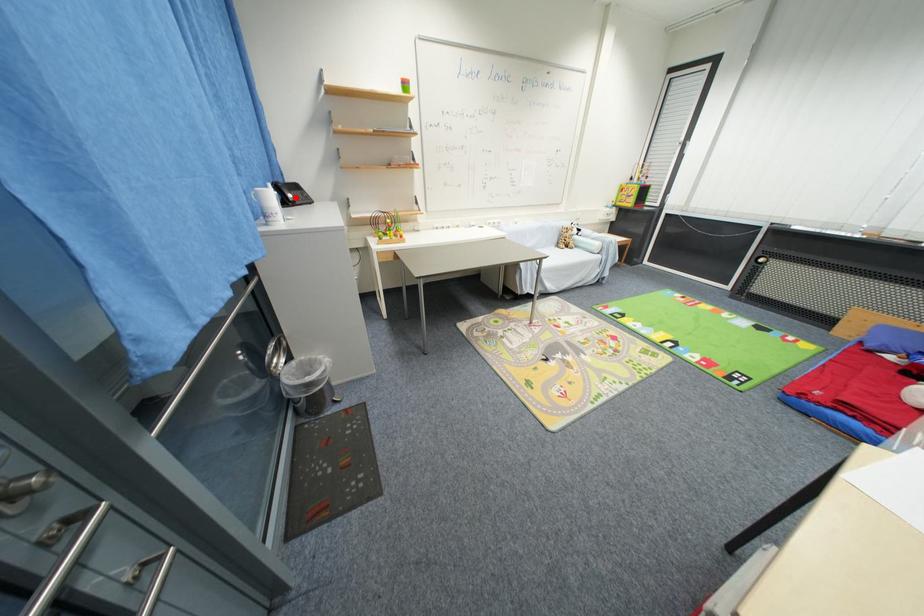
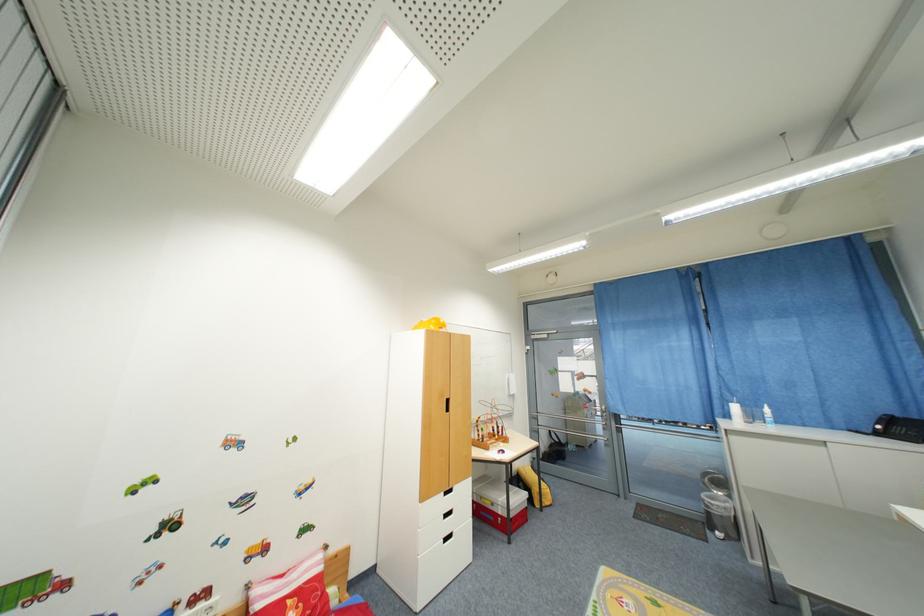
Question: I am providing you with two images of the same scene from different viewpoints. A red point is marked on the first image. Can you still see the location of the red point in image 2?

Choices:
 (A) Yes
 (B) No

Answer: (B)